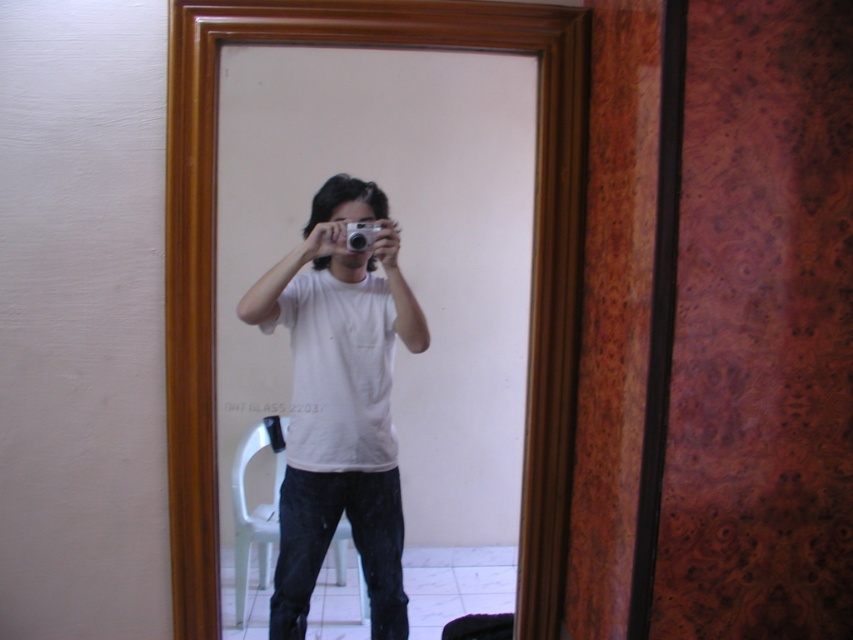
Can you confirm if white matte t-shirt at center is shorter than silver metallic camera at center?

No.

Who is more distant from viewer, (x=300, y=372) or (x=367, y=240)?

The point (x=300, y=372) is more distant.

Which is in front, point (392, 449) or point (370, 224)?

Point (370, 224)

The image size is (853, 640). What are the coordinates of `white matte t-shirt at center` in the screenshot? It's located at (340, 403).

Which is more to the right, wooden frame at center or white matte t-shirt at center?

wooden frame at center is more to the right.

Which is below, wooden frame at center or white matte t-shirt at center?

white matte t-shirt at center

The image size is (853, 640). What are the coordinates of `wooden frame at center` in the screenshot? It's located at (213, 259).

Is wooden frame at center smaller than silver metallic camera at center?

Incorrect, wooden frame at center is not smaller in size than silver metallic camera at center.

Find the location of a particular element. The image size is (853, 640). wooden frame at center is located at coordinates (213, 259).

Between point (184, 216) and point (372, 225), which one is positioned behind?

Point (372, 225)

At what (x,y) coordinates should I click in order to perform the action: click on wooden frame at center. Please return your answer as a coordinate pair (x, y). The height and width of the screenshot is (640, 853). Looking at the image, I should click on (213, 259).